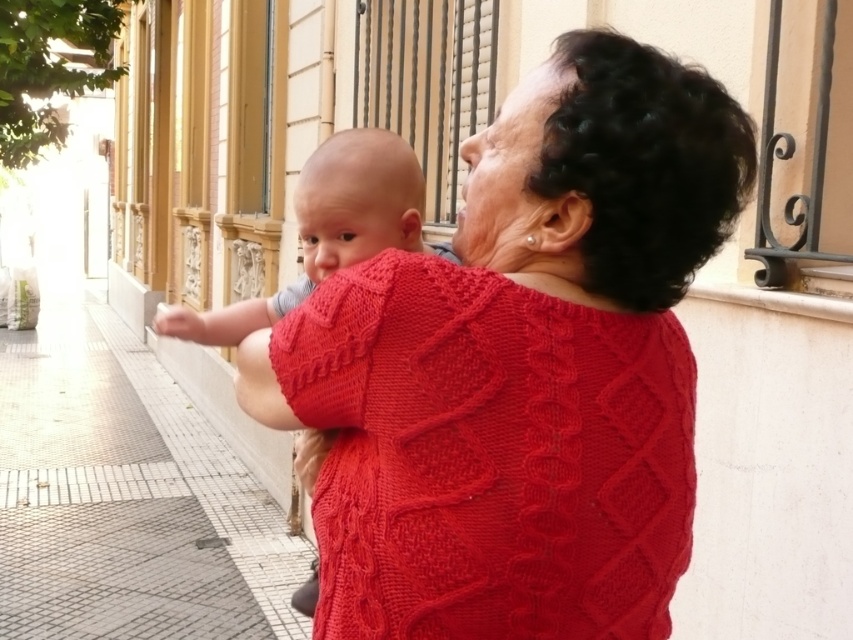
Which of these two, cable-knit sweater at center or smooth skin baby at center, stands taller?

Standing taller between the two is cable-knit sweater at center.

Looking at this image, can you confirm if cable-knit sweater at center is thinner than smooth skin baby at center?

Incorrect, cable-knit sweater at center's width is not less than smooth skin baby at center's.

Find the location of a particular element. The height and width of the screenshot is (640, 853). cable-knit sweater at center is located at coordinates (521, 369).

Find the location of a particular element. cable-knit sweater at center is located at coordinates (521, 369).

In the scene shown: Is gray mosaic pavement at lower left smaller than smooth skin baby at center?

No.

Does point (268, 568) come behind point (160, 314)?

No, (268, 568) is in front of (160, 314).

Locate an element on the screen. The image size is (853, 640). gray mosaic pavement at lower left is located at coordinates (126, 499).

Which of these two, cable-knit sweater at center or gray mosaic pavement at lower left, stands taller?

With more height is gray mosaic pavement at lower left.

Where is `cable-knit sweater at center`? This screenshot has width=853, height=640. cable-knit sweater at center is located at coordinates (521, 369).

Find the location of a particular element. This screenshot has height=640, width=853. cable-knit sweater at center is located at coordinates (521, 369).